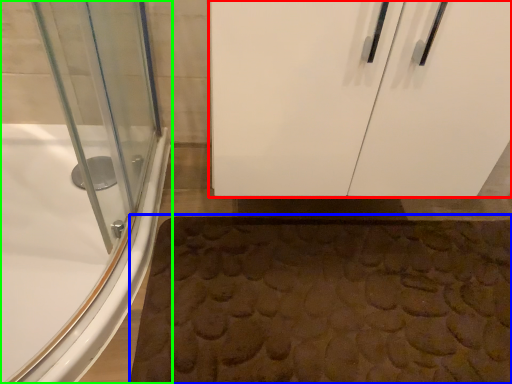
Question: Which object is the closest to the door (highlighted by a red box)? Choose among these: bath mat (highlighted by a blue box) or bathtub (highlighted by a green box).

Choices:
 (A) bath mat
 (B) bathtub

Answer: (A)